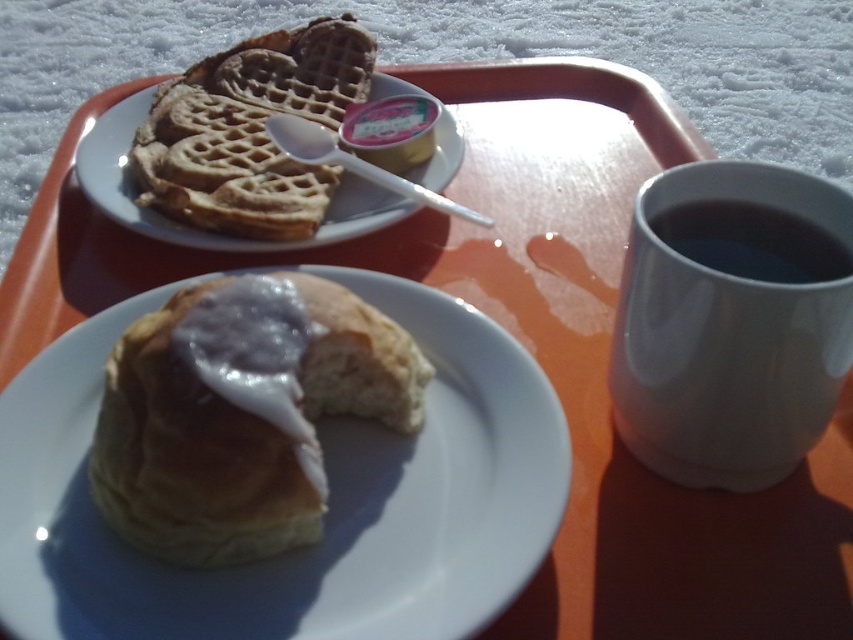
Question: Which of these objects is positioned closest to the white glossy icing at center?

Choices:
 (A) black matte mug at right
 (B) white glossy mug at upper right
 (C) golden brown waffle at upper left
 (D) glazed pastry at center

Answer: (D)

Question: Estimate the real-world distances between objects in this image. Which object is closer to the white glossy icing at center?

Choices:
 (A) white glossy mug at upper right
 (B) glazed doughnut at lower left
 (C) glazed pastry at center
 (D) black matte mug at right

Answer: (B)

Question: Among these points, which one is farthest from the camera?

Choices:
 (A) (381, 356)
 (B) (440, 300)
 (C) (784, 221)

Answer: (B)

Question: Is glazed pastry at center further to the viewer compared to glazed doughnut at lower left?

Choices:
 (A) no
 (B) yes

Answer: (A)

Question: Can you confirm if glazed doughnut at lower left is positioned above white glossy mug at upper right?

Choices:
 (A) yes
 (B) no

Answer: (B)

Question: Does golden brown waffle at upper left have a smaller size compared to black matte mug at right?

Choices:
 (A) yes
 (B) no

Answer: (B)